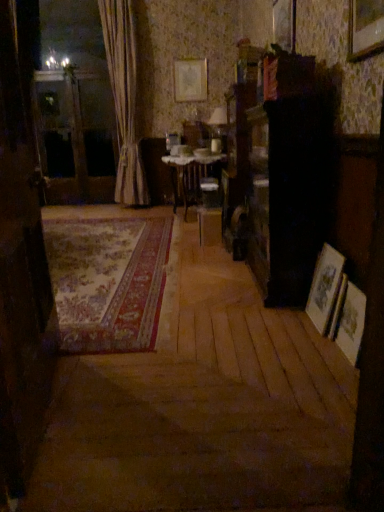
The height and width of the screenshot is (512, 384). Find the location of `vacant space behind transparent glass screen door at left, acting as the second screen door starting from the left`. vacant space behind transparent glass screen door at left, acting as the second screen door starting from the left is located at coordinates (119, 331).